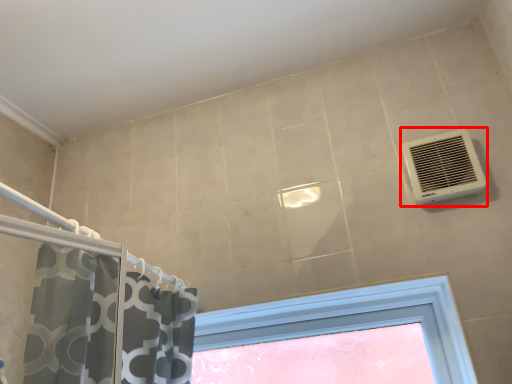
Question: From the image's perspective, what is the correct spatial relationship of air conditioning (annotated by the red box) in relation to window?

Choices:
 (A) above
 (B) below

Answer: (A)